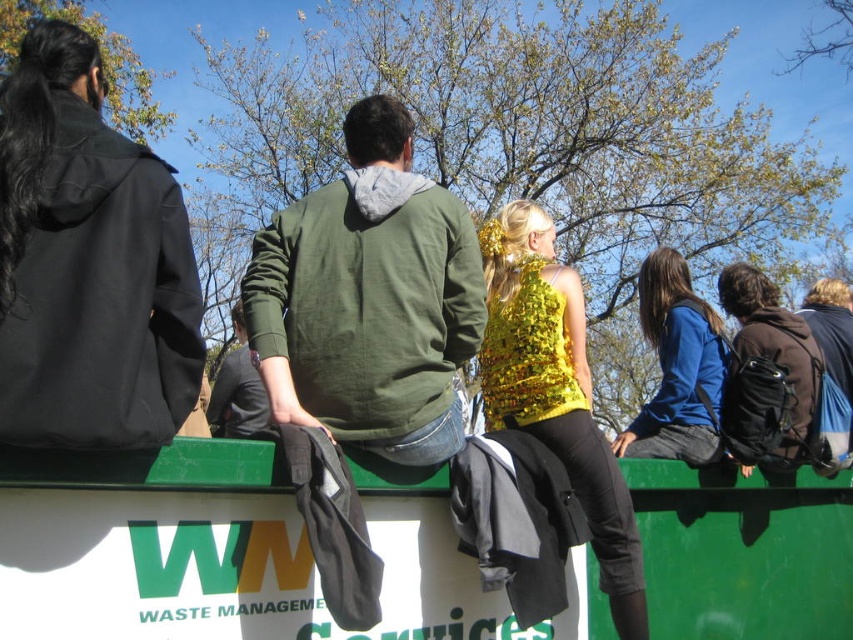
Who is more distant from viewer, (628, 504) or (654, 337)?

Positioned behind is point (654, 337).

Between point (577, 376) and point (712, 422), which one is positioned in front?

Point (577, 376) is in front.

You are a GUI agent. You are given a task and a screenshot of the screen. Output one action in this format:
    pyautogui.click(x=<x>, y=<y>)
    Task: Click on the gold sequined top at center
    The height and width of the screenshot is (640, 853).
    Given the screenshot: What is the action you would take?
    pyautogui.click(x=555, y=390)

This screenshot has height=640, width=853. Find the location of `gold sequined top at center`. gold sequined top at center is located at coordinates (555, 390).